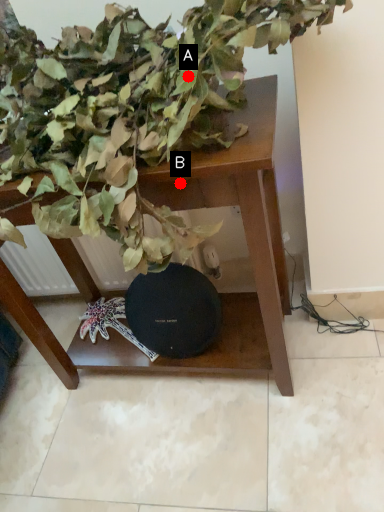
Question: Two points are circled on the image, labeled by A and B beside each circle. Which of the following is the closest to the observer?

Choices:
 (A) A is closer
 (B) B is closer

Answer: (A)